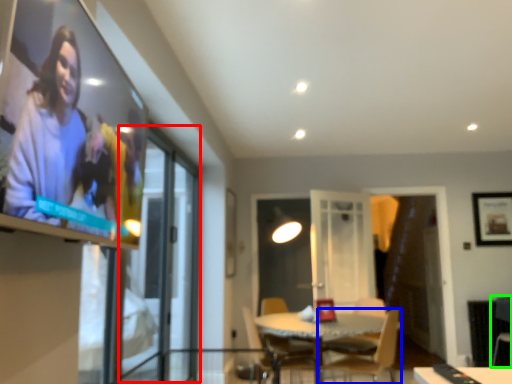
Question: Based on their relative distances, which object is nearer to screen door (highlighted by a red box)? Choose from chair (highlighted by a blue box) and armchair (highlighted by a green box).

Choices:
 (A) chair
 (B) armchair

Answer: (A)